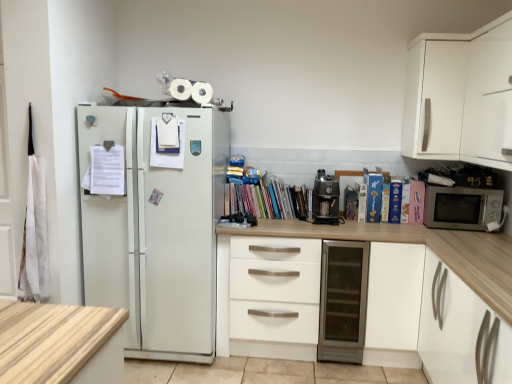
Identify the location of free location in front of blue matte paperback book at upper right, which appears as the fifth paperback book when viewed from the right. The width and height of the screenshot is (512, 384). (377, 226).